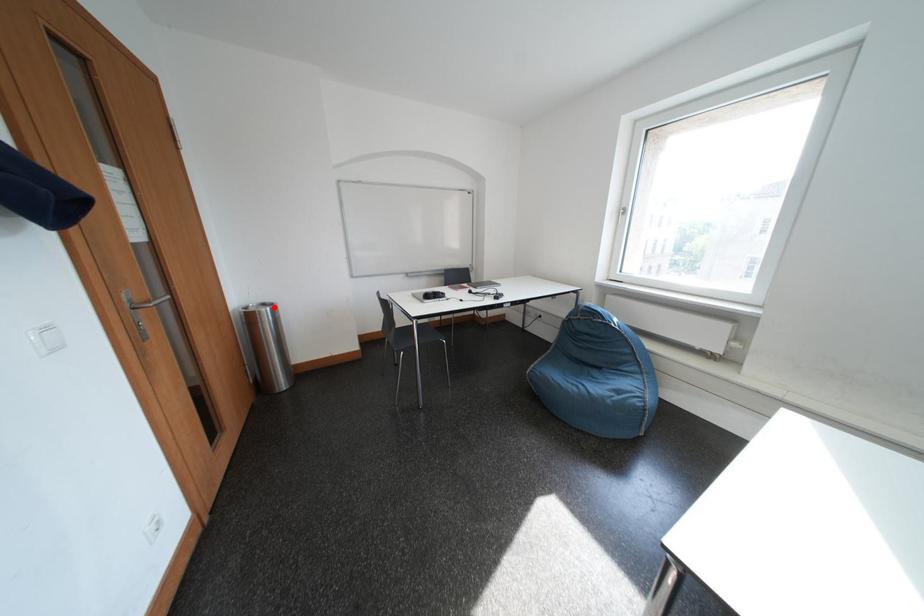
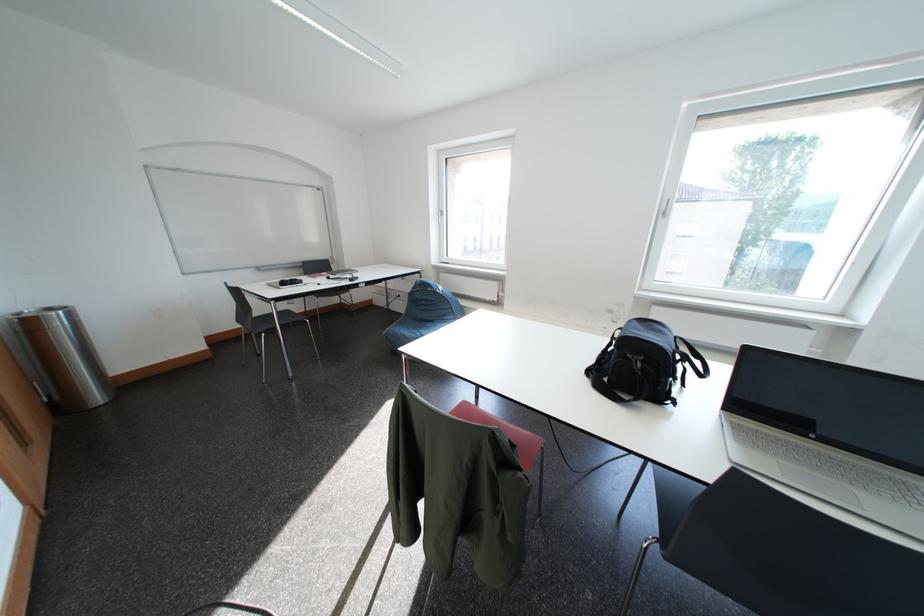
Question: I am providing you with two images of the same scene from different viewpoints. A red point is shown in image1. For the corresponding object point in image2, is it positioned nearer or farther from the camera?

Choices:
 (A) Nearer
 (B) Farther

Answer: (B)